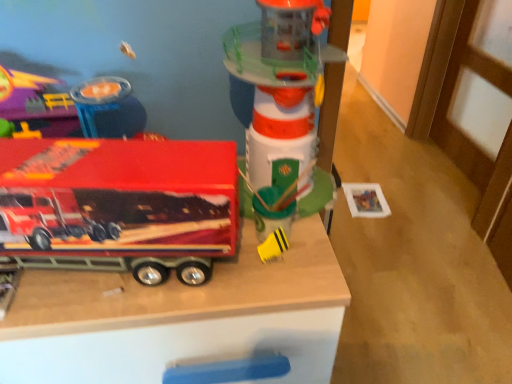
Question: From the image's perspective, is shiny red truck at left, the first toy positioned from the left, located beneath translucent plastic lighthouse at center, the 4th toy viewed from the left?

Choices:
 (A) yes
 (B) no

Answer: (A)

Question: Does shiny red truck at left, the first toy positioned from the left, turn towards translucent plastic lighthouse at center, the 4th toy viewed from the left?

Choices:
 (A) no
 (B) yes

Answer: (A)

Question: Does shiny red truck at left, positioned as the fourth toy in right-to-left order, lie in front of translucent plastic lighthouse at center, the 4th toy viewed from the left?

Choices:
 (A) yes
 (B) no

Answer: (B)

Question: From the image's perspective, is shiny red truck at left, the first toy positioned from the left, above translucent plastic lighthouse at center, the 4th toy viewed from the left?

Choices:
 (A) yes
 (B) no

Answer: (B)

Question: Does shiny red truck at left, the first toy positioned from the left, have a greater width compared to translucent plastic lighthouse at center, the 4th toy viewed from the left?

Choices:
 (A) yes
 (B) no

Answer: (B)

Question: Is translucent plastic lighthouse at center, the 4th toy viewed from the left, in front of or behind wooden toy truck at center in the image?

Choices:
 (A) behind
 (B) front

Answer: (A)

Question: From a real-world perspective, is translucent plastic lighthouse at center, the 4th toy viewed from the left, positioned above or below wooden toy truck at center?

Choices:
 (A) above
 (B) below

Answer: (A)

Question: Considering the positions of point (250, 142) and point (69, 309), is point (250, 142) closer or farther from the camera than point (69, 309)?

Choices:
 (A) closer
 (B) farther

Answer: (B)

Question: Visually, is translucent plastic lighthouse at center, the first toy when ordered from right to left, positioned to the left or to the right of wooden toy truck at center?

Choices:
 (A) right
 (B) left

Answer: (A)

Question: Which is correct: yellow rubber duck at center, which is counted as the 2th toy, starting from the right, is inside metallic red truck at left, the third toy positioned from the right, or outside of it?

Choices:
 (A) outside
 (B) inside

Answer: (A)

Question: Does point (269, 248) appear closer or farther from the camera than point (16, 148)?

Choices:
 (A) closer
 (B) farther

Answer: (B)

Question: Is yellow rubber duck at center, which is counted as the 2th toy, starting from the right, bigger or smaller than metallic red truck at left, the third toy positioned from the right?

Choices:
 (A) small
 (B) big

Answer: (A)

Question: From their relative heights in the image, would you say yellow rubber duck at center, the 3th toy viewed from the left, is taller or shorter than metallic red truck at left, the third toy positioned from the right?

Choices:
 (A) short
 (B) tall

Answer: (A)

Question: Considering the positions of shiny red truck at left, positioned as the fourth toy in right-to-left order, and yellow rubber duck at center, which is counted as the 2th toy, starting from the right, in the image, is shiny red truck at left, positioned as the fourth toy in right-to-left order, bigger or smaller than yellow rubber duck at center, which is counted as the 2th toy, starting from the right,?

Choices:
 (A) big
 (B) small

Answer: (A)

Question: Is point (98, 84) positioned closer to the camera than point (279, 241)?

Choices:
 (A) closer
 (B) farther

Answer: (B)